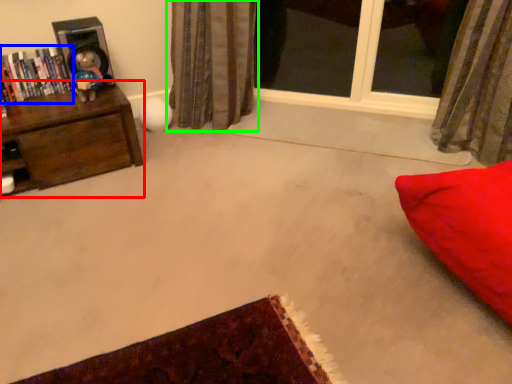
Question: Which object is positioned farthest from furniture (highlighted by a red box)? Select from book (highlighted by a blue box) and curtain (highlighted by a green box).

Choices:
 (A) book
 (B) curtain

Answer: (B)